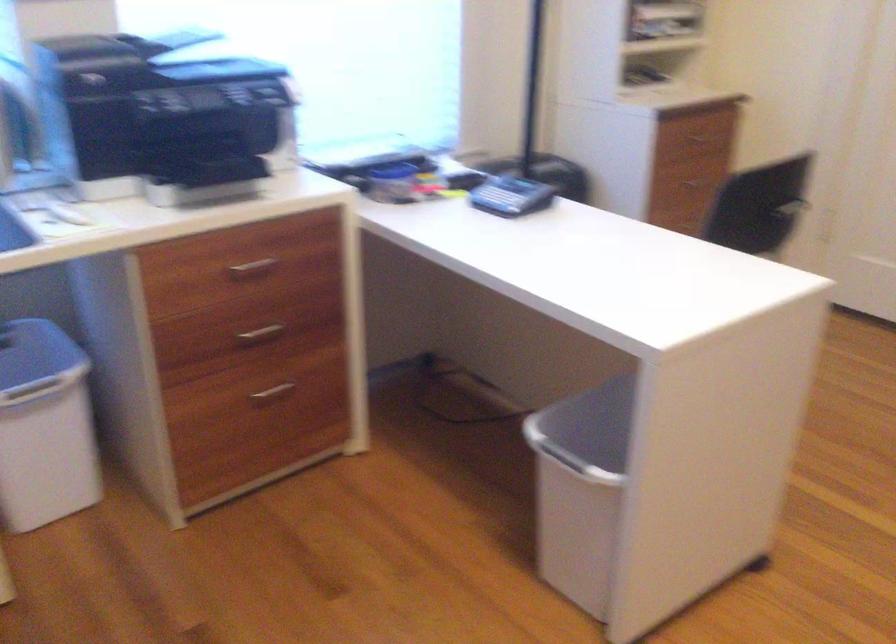
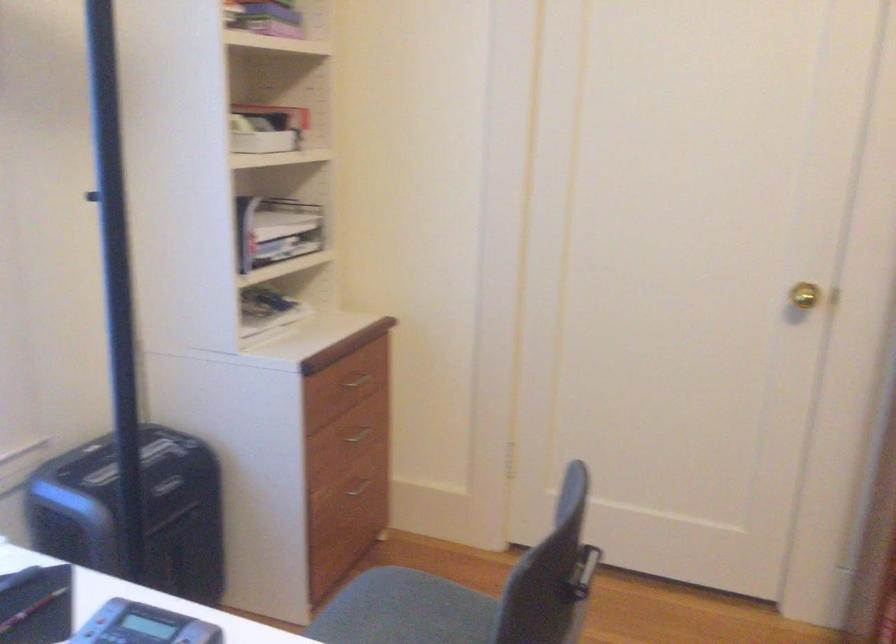
Question: The first image is from the beginning of the video and the second image is from the end. How did the camera likely rotate when shooting the video?

Choices:
 (A) Left
 (B) Right
 (C) Up
 (D) Down

Answer: (B)